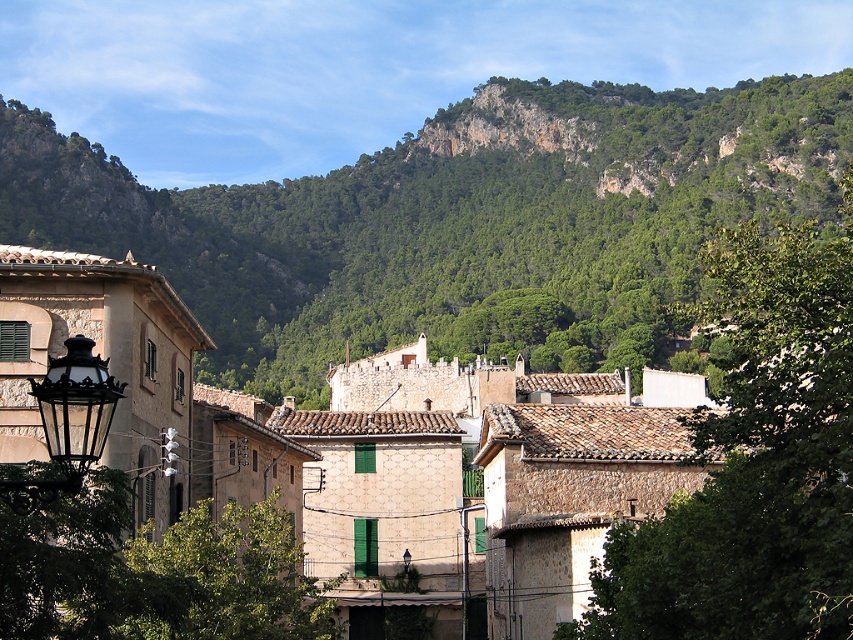
Question: Which object is the closest to the green leafy mountain at upper center?

Choices:
 (A) green leafy tree at upper center
 (B) black wrought iron streetlight at left
 (C) green leafy tree at lower left

Answer: (A)

Question: Among these points, which one is nearest to the camera?

Choices:
 (A) (772, 355)
 (B) (323, 205)

Answer: (A)

Question: Which object is farther from the camera taking this photo?

Choices:
 (A) green leafy tree at upper center
 (B) black wrought iron streetlight at left
 (C) green leafy tree at lower left
 (D) green leafy mountain at upper center

Answer: (D)

Question: Is stone village at center thinner than green leafy tree at lower left?

Choices:
 (A) yes
 (B) no

Answer: (B)

Question: Is green leafy mountain at upper center further to the viewer compared to green leafy tree at lower left?

Choices:
 (A) no
 (B) yes

Answer: (B)

Question: Where is green leafy tree at lower left located in relation to black wrought iron streetlight at left in the image?

Choices:
 (A) right
 (B) left

Answer: (A)